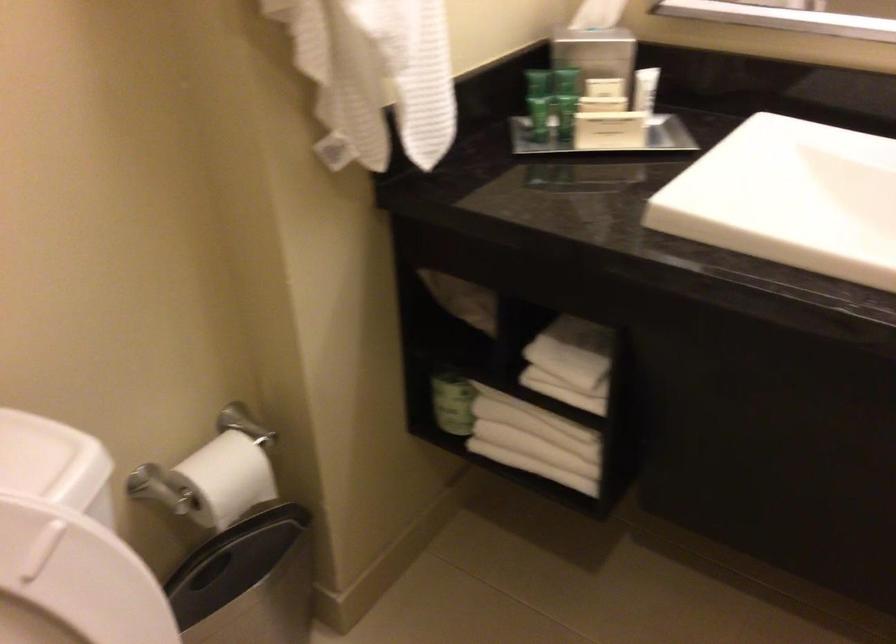
Where is `white toilet lid`? white toilet lid is located at coordinates (73, 582).